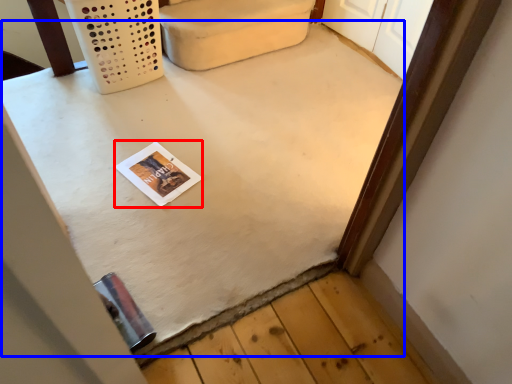
Question: Which object is further to the camera taking this photo, magazine (highlighted by a red box) or table (highlighted by a blue box)?

Choices:
 (A) magazine
 (B) table

Answer: (A)